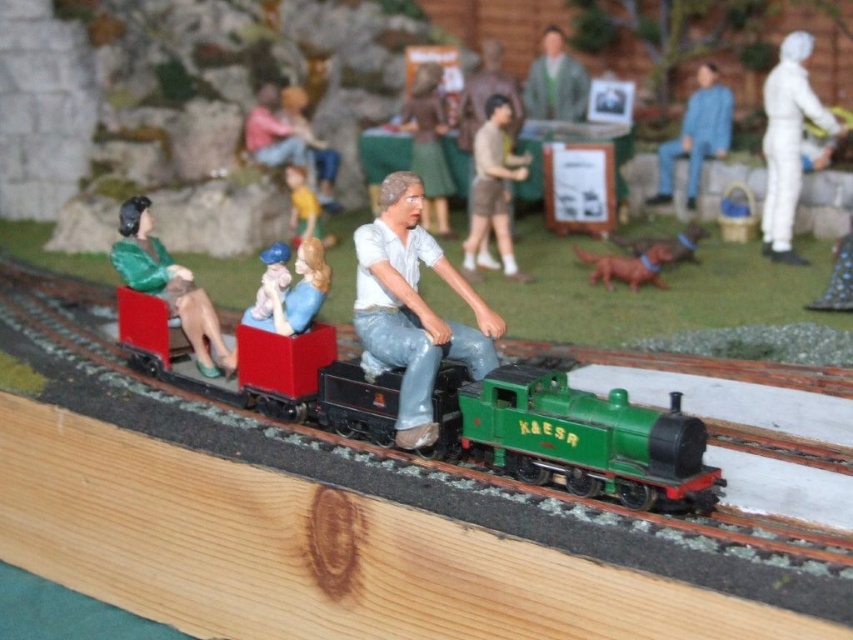
Question: Among these objects, which one is nearest to the camera?

Choices:
 (A) blue denim jeans at right
 (B) green matte figure at left
 (C) smooth yellow toy at center
 (D) brown matte shorts at center

Answer: (B)

Question: Is the position of green matte train at center less distant than that of smooth beige figurine at center?

Choices:
 (A) yes
 (B) no

Answer: (A)

Question: Which point appears farthest from the camera in this image?

Choices:
 (A) (514, 269)
 (B) (593, 269)
 (C) (802, 109)

Answer: (C)

Question: Which point is closer to the camera?

Choices:
 (A) matte white shirt at center
 (B) matte green jacket at center
 (C) green matte figure at left
 (D) smooth beige figurine at center

Answer: (A)

Question: Is matte white shirt at center behind green matte figure at left?

Choices:
 (A) no
 (B) yes

Answer: (A)

Question: Can you confirm if brown matte shorts at center is positioned to the right of smooth yellow toy at center?

Choices:
 (A) yes
 (B) no

Answer: (A)